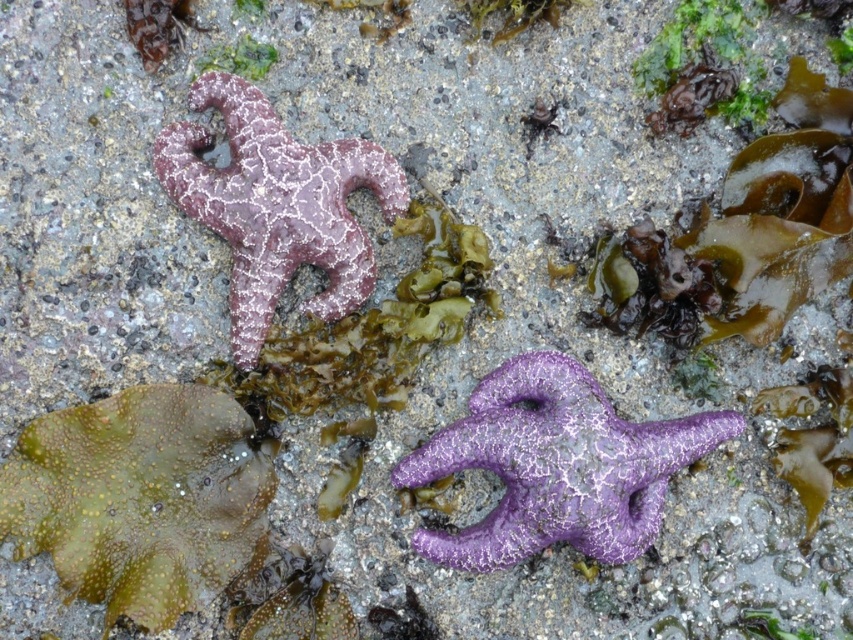
From the picture: Between purple matte starfish at center and green matte algae at upper center, which one is positioned higher?

Positioned higher is green matte algae at upper center.

Is point (438, 534) positioned behind point (267, 67)?

No.

Where is `purple matte starfish at center`? The width and height of the screenshot is (853, 640). purple matte starfish at center is located at coordinates (556, 465).

This screenshot has width=853, height=640. Identify the location of purple matte starfish at center. (556, 465).

Does point (579, 380) come closer to viewer compared to point (306, 212)?

No.

Does purple matte starfish at center have a larger size compared to purple matte starfish at upper left?

Yes.

Between point (463, 433) and point (241, 298), which one is positioned behind?

The point (241, 298) is behind.

Locate an element on the screen. purple matte starfish at center is located at coordinates (556, 465).

Is point (196, 104) more distant than point (256, 60)?

No, it is in front of (256, 60).

Can you confirm if purple matte starfish at upper left is shorter than green matte algae at upper center?

No, purple matte starfish at upper left is not shorter than green matte algae at upper center.

Describe the element at coordinates (276, 204) in the screenshot. The height and width of the screenshot is (640, 853). I see `purple matte starfish at upper left` at that location.

The height and width of the screenshot is (640, 853). I want to click on purple matte starfish at upper left, so click(276, 204).